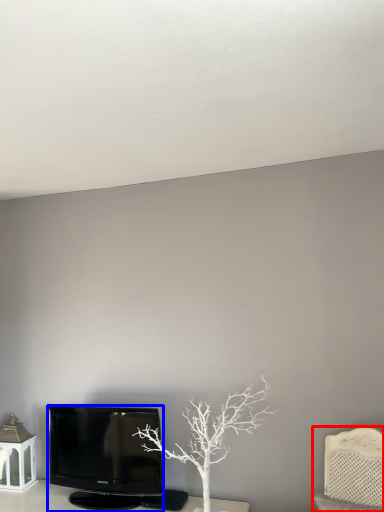
Question: Which object appears farthest to the camera in this image, furniture (highlighted by a red box) or television (highlighted by a blue box)?

Choices:
 (A) furniture
 (B) television

Answer: (B)